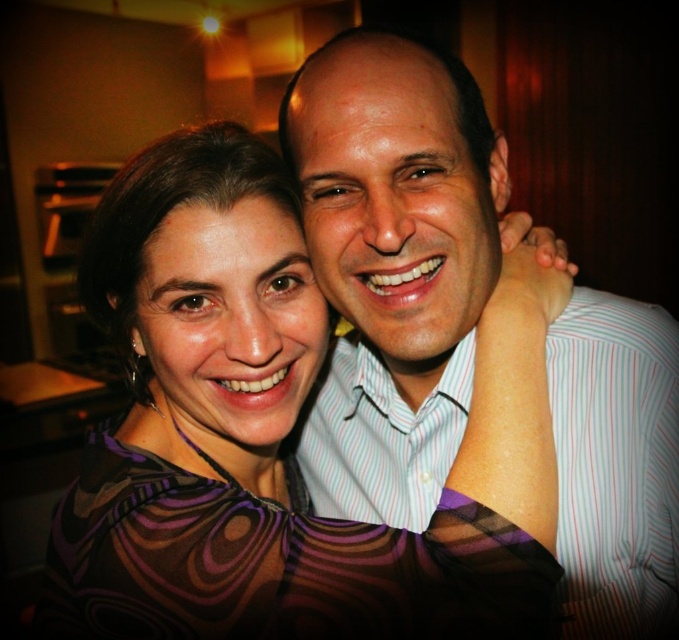
You are planning to sit between the patterned fabric dress at center and the white striped shirt at center. Which side should you choose if you want more space?

The patterned fabric dress at center is wider than the white striped shirt at center, so you should sit on the side of the white striped shirt at center to have more space.

You are standing in front of a photograph and want to determine which of the two points, point (153,605) or point (348,291), is nearer to you. Based on the image, which point is closer?

Point (153,605) is closer to the viewer than point (348,291).